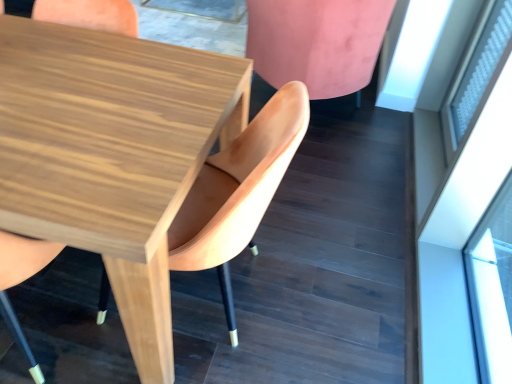
Question: Is wooden chair at center, the 2th chair from the right, oriented towards white frosted glass at upper right?

Choices:
 (A) yes
 (B) no

Answer: (B)

Question: Considering the relative sizes of wooden chair at center, the 2th chair from the right, and white frosted glass at upper right in the image provided, is wooden chair at center, the 2th chair from the right, wider than white frosted glass at upper right?

Choices:
 (A) yes
 (B) no

Answer: (A)

Question: Is wooden chair at center, the 2th chair from the right, next to white frosted glass at upper right?

Choices:
 (A) yes
 (B) no

Answer: (B)

Question: Considering the relative sizes of wooden chair at center, the 2th chair from the left, and white frosted glass at upper right in the image provided, is wooden chair at center, the 2th chair from the left, taller than white frosted glass at upper right?

Choices:
 (A) yes
 (B) no

Answer: (A)

Question: From a real-world perspective, is wooden chair at center, the 2th chair from the left, positioned under white frosted glass at upper right based on gravity?

Choices:
 (A) yes
 (B) no

Answer: (A)

Question: Based on their positions, is pink velvet chair at upper right, which is the 3th chair in left-to-right order, located to the left or right of white frosted glass at upper right?

Choices:
 (A) right
 (B) left

Answer: (B)

Question: From a real-world perspective, relative to white frosted glass at upper right, is pink velvet chair at upper right, which ranks as the first chair in right-to-left order, vertically above or below?

Choices:
 (A) above
 (B) below

Answer: (B)

Question: Which is correct: pink velvet chair at upper right, which is the 3th chair in left-to-right order, is inside white frosted glass at upper right, or outside of it?

Choices:
 (A) inside
 (B) outside

Answer: (B)

Question: Looking at their shapes, would you say pink velvet chair at upper right, which ranks as the first chair in right-to-left order, is wider or thinner than white frosted glass at upper right?

Choices:
 (A) wide
 (B) thin

Answer: (A)

Question: In terms of size, does wooden chair at center, the first chair positioned from the left, appear bigger or smaller than pink velvet chair at upper right, which ranks as the first chair in right-to-left order?

Choices:
 (A) big
 (B) small

Answer: (B)

Question: From their relative heights in the image, would you say wooden chair at center, the first chair positioned from the left, is taller or shorter than pink velvet chair at upper right, which ranks as the first chair in right-to-left order?

Choices:
 (A) tall
 (B) short

Answer: (A)

Question: From a real-world perspective, is wooden chair at center, arranged as the 3th chair when viewed from the right, above or below pink velvet chair at upper right, which ranks as the first chair in right-to-left order?

Choices:
 (A) above
 (B) below

Answer: (A)

Question: Is wooden chair at center, arranged as the 3th chair when viewed from the right, to the left or to the right of pink velvet chair at upper right, which ranks as the first chair in right-to-left order, in the image?

Choices:
 (A) right
 (B) left

Answer: (B)

Question: From a real-world perspective, is wooden table at center positioned above or below transparent glass door at upper right?

Choices:
 (A) above
 (B) below

Answer: (B)

Question: In the image, is wooden table at center on the left side or the right side of transparent glass door at upper right?

Choices:
 (A) left
 (B) right

Answer: (A)